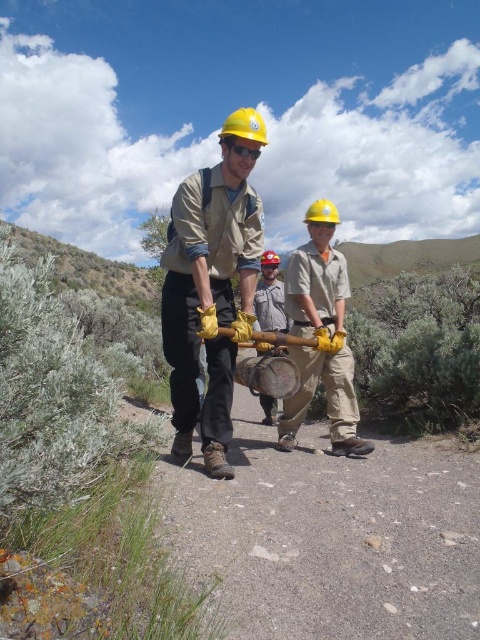
Question: Does matte yellow hard hat at center have a lesser width compared to brushed metal bucket at center?

Choices:
 (A) no
 (B) yes

Answer: (A)

Question: In this image, where is matte yellow hard hat at center located relative to brushed metal bucket at center?

Choices:
 (A) above
 (B) below

Answer: (A)

Question: Which point is closer to the camera?

Choices:
 (A) (184, 259)
 (B) (269, 268)

Answer: (A)

Question: Does matte yellow hard hat at center appear on the right side of brushed metal bucket at center?

Choices:
 (A) yes
 (B) no

Answer: (B)

Question: Which point is closer to the camera?

Choices:
 (A) matte yellow hard hat at center
 (B) brushed metal bucket at center

Answer: (A)